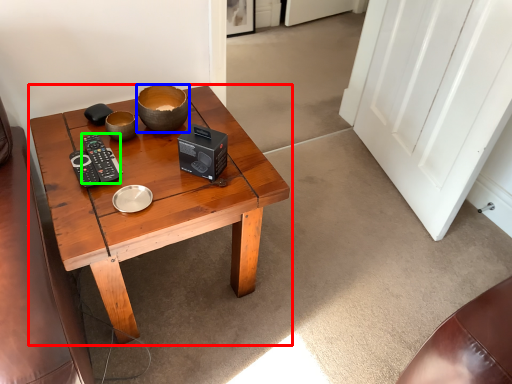
Question: Which is farther away from coffee table (highlighted by a red box)? bowl (highlighted by a blue box) or control (highlighted by a green box)?

Choices:
 (A) bowl
 (B) control

Answer: (A)